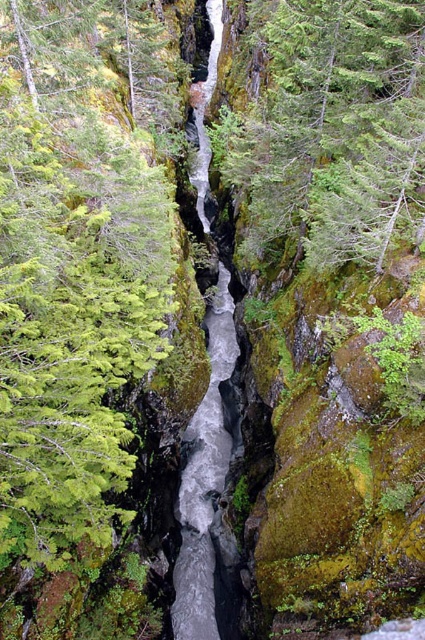
Question: Based on their relative distances, which object is farther from the green needle-like foliage at left?

Choices:
 (A) gray smooth stream at center
 (B) green mossy tree at center

Answer: (A)

Question: Does green mossy tree at center lie behind gray smooth stream at center?

Choices:
 (A) no
 (B) yes

Answer: (A)

Question: Which is farther from the green needle-like foliage at left?

Choices:
 (A) green mossy tree at center
 (B) gray smooth stream at center

Answer: (B)

Question: Does green needle-like foliage at left appear on the right side of green mossy tree at center?

Choices:
 (A) yes
 (B) no

Answer: (B)

Question: In this image, where is green mossy tree at center located relative to gray smooth stream at center?

Choices:
 (A) right
 (B) left

Answer: (A)

Question: Which point is closer to the camera taking this photo?

Choices:
 (A) (221, 522)
 (B) (144, 134)

Answer: (B)